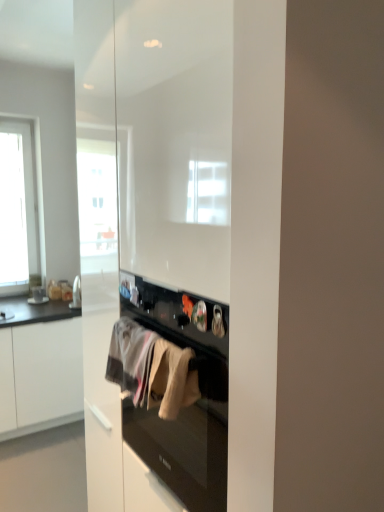
Question: Can you confirm if white cotton towel at center, the first clothing in the left-to-right sequence, is positioned to the right of white matte cabinet at left?

Choices:
 (A) no
 (B) yes

Answer: (B)

Question: Is white matte cabinet at left at the back of white cotton towel at center, marked as the second clothing in a right-to-left arrangement?

Choices:
 (A) no
 (B) yes

Answer: (A)

Question: Does white cotton towel at center, placed as the 2th clothing when sorted from front to back, appear on the left side of white matte cabinet at left?

Choices:
 (A) no
 (B) yes

Answer: (A)

Question: Is white cotton towel at center, the first clothing in the left-to-right sequence, taller than white matte cabinet at left?

Choices:
 (A) no
 (B) yes

Answer: (A)

Question: Is white cotton towel at center, marked as the second clothing in a right-to-left arrangement, outside white matte cabinet at left?

Choices:
 (A) no
 (B) yes

Answer: (B)

Question: From a real-world perspective, is white matte cabinet at left above or below white cotton towel at center, placed as the 2th clothing when sorted from left to right?

Choices:
 (A) below
 (B) above

Answer: (A)

Question: Is white matte cabinet at left to the left or to the right of white cotton towel at center, the 2th clothing in the back-to-front sequence, in the image?

Choices:
 (A) right
 (B) left

Answer: (B)

Question: Would you say white matte cabinet at left is inside or outside white cotton towel at center, placed as the 2th clothing when sorted from left to right?

Choices:
 (A) outside
 (B) inside

Answer: (A)

Question: Based on their sizes in the image, would you say white matte cabinet at left is bigger or smaller than white cotton towel at center, placed as the 2th clothing when sorted from left to right?

Choices:
 (A) big
 (B) small

Answer: (A)

Question: Is white cotton towel at center, placed as the 2th clothing when sorted from left to right, inside the boundaries of white matte cabinet at left, or outside?

Choices:
 (A) outside
 (B) inside

Answer: (A)

Question: From a real-world perspective, is white cotton towel at center, placed as the 2th clothing when sorted from left to right, positioned above or below white matte cabinet at left?

Choices:
 (A) above
 (B) below

Answer: (A)

Question: Visually, is white cotton towel at center, placed as the 2th clothing when sorted from left to right, positioned to the left or to the right of white matte cabinet at left?

Choices:
 (A) right
 (B) left

Answer: (A)

Question: Looking at the image, does white cotton towel at center, which is the first clothing from front to back, seem bigger or smaller compared to white matte cabinet at left?

Choices:
 (A) big
 (B) small

Answer: (B)

Question: In terms of width, does white cotton towel at center, which is the first clothing from front to back, look wider or thinner when compared to white cotton towel at center, marked as the second clothing in a right-to-left arrangement?

Choices:
 (A) thin
 (B) wide

Answer: (A)

Question: Is white cotton towel at center, which is the first clothing from front to back, taller or shorter than white cotton towel at center, marked as the second clothing in a right-to-left arrangement?

Choices:
 (A) tall
 (B) short

Answer: (B)